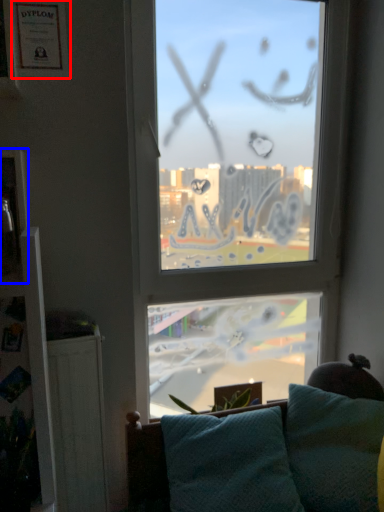
Question: Which point is closer to the camera, picture frame (highlighted by a red box) or picture frame (highlighted by a blue box)?

Choices:
 (A) picture frame
 (B) picture frame

Answer: (B)